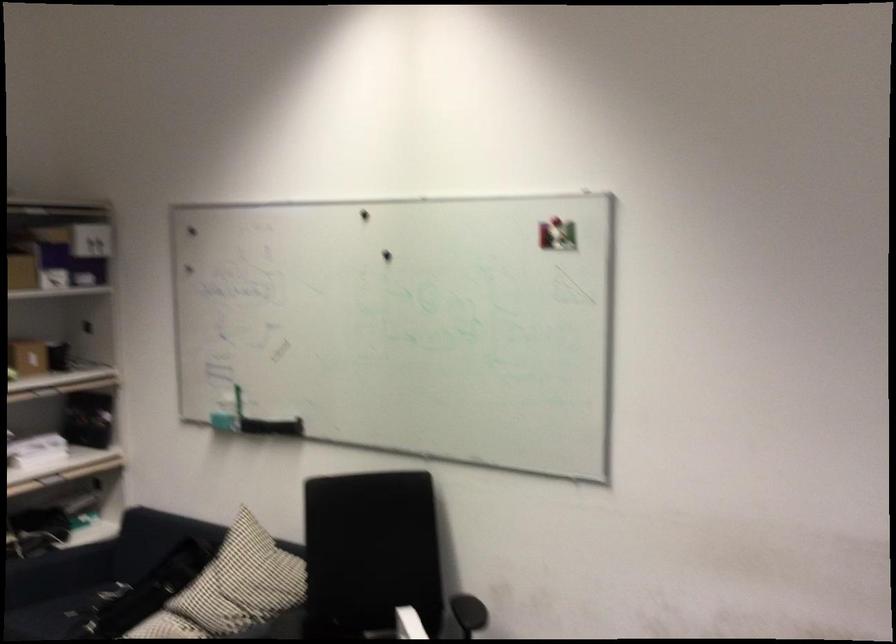
Locate an element on the screen. striped pillow is located at coordinates (231, 588).